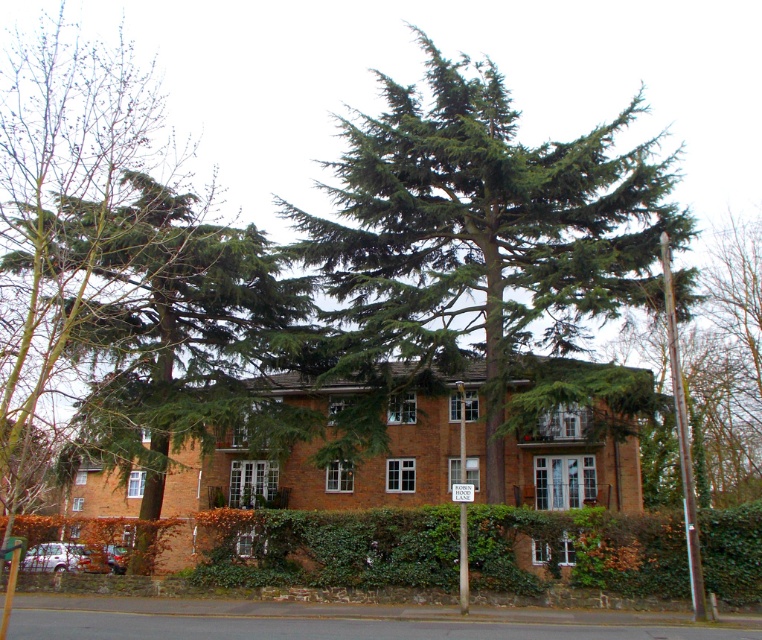
The height and width of the screenshot is (640, 762). What do you see at coordinates (482, 236) in the screenshot?
I see `green needle-like leaves at center` at bounding box center [482, 236].

Does green needle-like leaves at center appear over white plastic sign at center?

Yes, green needle-like leaves at center is above white plastic sign at center.

Does point (431, 125) come in front of point (450, 486)?

That is True.

This screenshot has width=762, height=640. Identify the location of green needle-like leaves at center. (482, 236).

Describe the element at coordinates (181, 333) in the screenshot. This screenshot has height=640, width=762. I see `green leafy tree at center` at that location.

Is green leafy tree at center smaller than white plastic sign at center?

No, green leafy tree at center is not smaller than white plastic sign at center.

Who is more forward, [287,301] or [471,496]?

Point [471,496] is in front.

Find the location of `green leafy tree at center`. green leafy tree at center is located at coordinates (181, 333).

Can you confirm if green needle-like leaves at center is positioned to the right of green leafy tree at center?

Yes, green needle-like leaves at center is to the right of green leafy tree at center.

Is green needle-like leaves at center shorter than green leafy tree at center?

In fact, green needle-like leaves at center may be taller than green leafy tree at center.

This screenshot has height=640, width=762. What are the coordinates of `green needle-like leaves at center` in the screenshot? It's located at (482, 236).

Where is `green needle-like leaves at center`? The width and height of the screenshot is (762, 640). green needle-like leaves at center is located at coordinates click(482, 236).